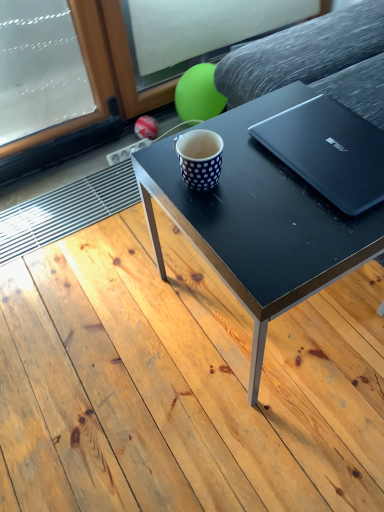
Find the location of a particular element. Image resolution: width=384 pixels, height=512 pixels. vacant area to the right of white dotted mug at center is located at coordinates (260, 178).